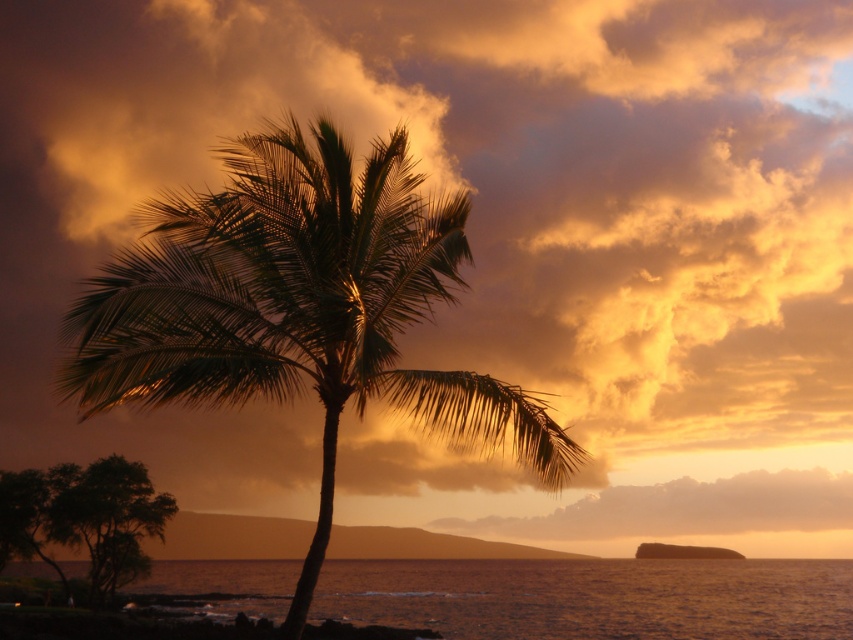
Can you confirm if green leafy palm tree at center is thinner than smooth water at lower center?

Yes, green leafy palm tree at center is thinner than smooth water at lower center.

This screenshot has width=853, height=640. What do you see at coordinates (299, 307) in the screenshot? I see `green leafy palm tree at center` at bounding box center [299, 307].

Which is in front, point (175, 262) or point (850, 600)?

Positioned in front is point (175, 262).

Find the location of a particular element. green leafy palm tree at center is located at coordinates (x=299, y=307).